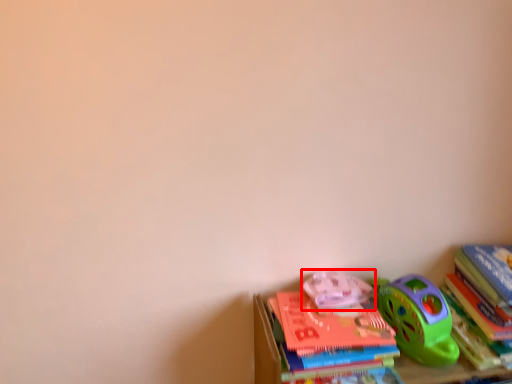
Question: In this image, where is toy (annotated by the red box) located relative to book?

Choices:
 (A) left
 (B) right

Answer: (A)